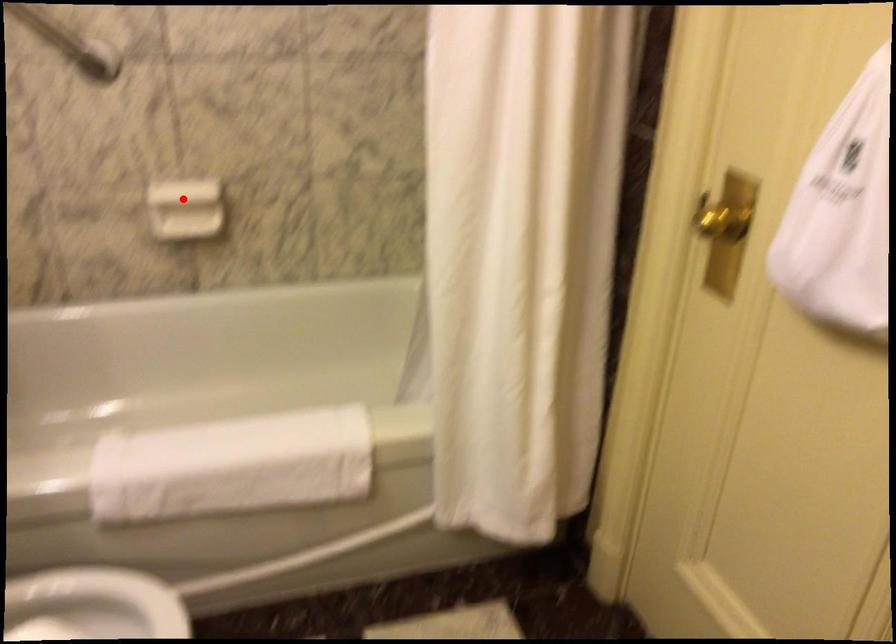
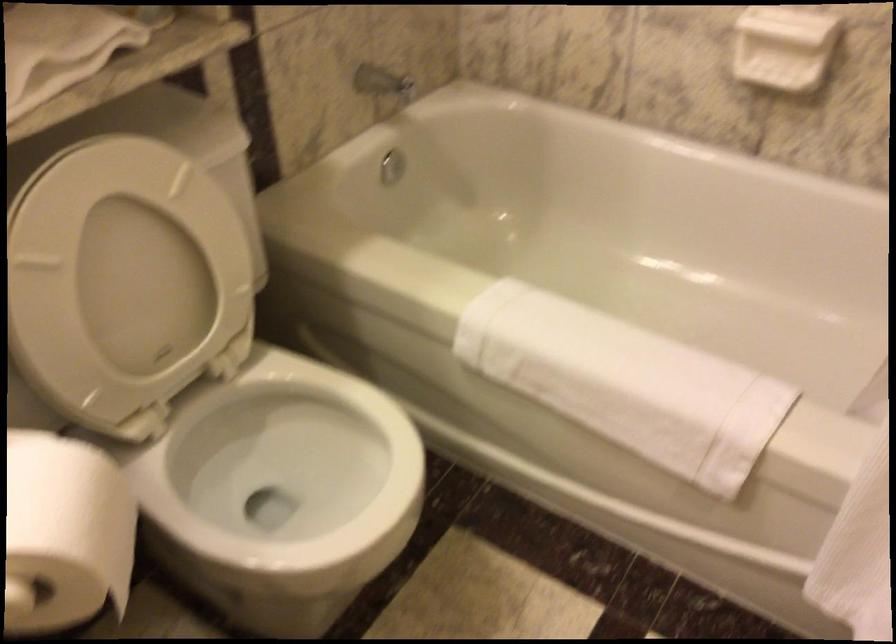
Question: I am providing you with two images of the same scene from different viewpoints. Image1 has a red point marked. In image2, the corresponding 3D location appears at what relative position? Reply with the corresponding letter.

Choices:
 (A) Closer
 (B) Farther

Answer: (A)